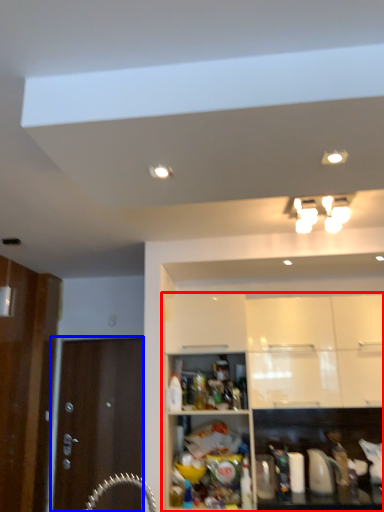
Question: Which of the following is the farthest to the observer, cabinetry (highlighted by a red box) or door (highlighted by a blue box)?

Choices:
 (A) cabinetry
 (B) door

Answer: (B)